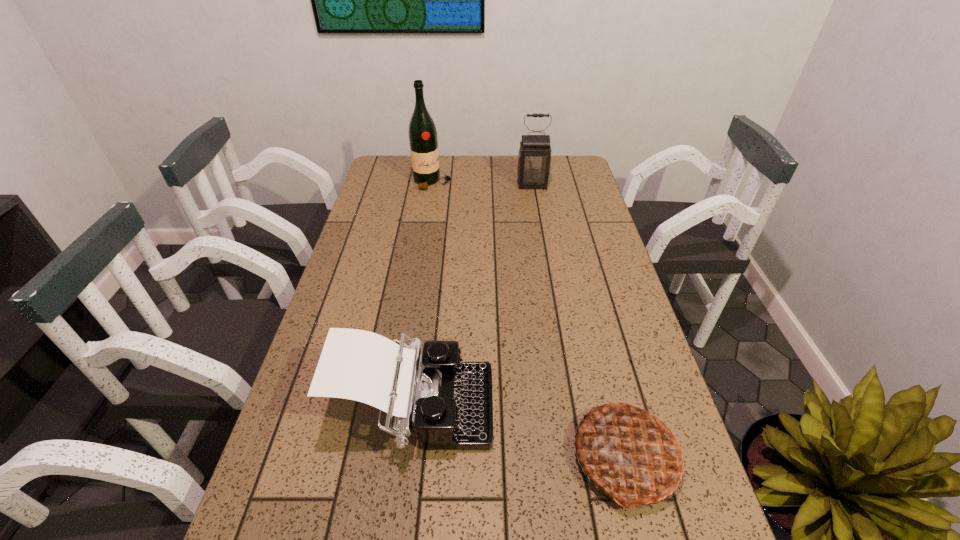
The width and height of the screenshot is (960, 540). I want to click on wine bottle that is positioned at the left edge, so click(423, 141).

Where is `typewriter that is at the left edge`? This screenshot has width=960, height=540. typewriter that is at the left edge is located at coordinates (450, 401).

Identify the location of lantern that is at the right edge. (534, 159).

Locate an element on the screen. Image resolution: width=960 pixels, height=540 pixels. pie that is at the right edge is located at coordinates (627, 451).

This screenshot has width=960, height=540. What are the coordinates of `object that is positioned at the far left corner` in the screenshot? It's located at (423, 141).

Where is `object positioned at the far right corner`? This screenshot has width=960, height=540. object positioned at the far right corner is located at coordinates pos(534,159).

Image resolution: width=960 pixels, height=540 pixels. In the image, there is a desktop. What are the coordinates of `vacant region at the far edge` in the screenshot? It's located at (469, 160).

In order to click on free location at the left edge in this screenshot , I will do `click(344, 260)`.

Identify the location of free space at the right edge of the desktop. (586, 218).

At what (x,y) coordinates should I click in order to perform the action: click on free region at the far left corner of the desktop. Please return your answer as a coordinate pair (x, y). The image size is (960, 540). Looking at the image, I should click on (402, 174).